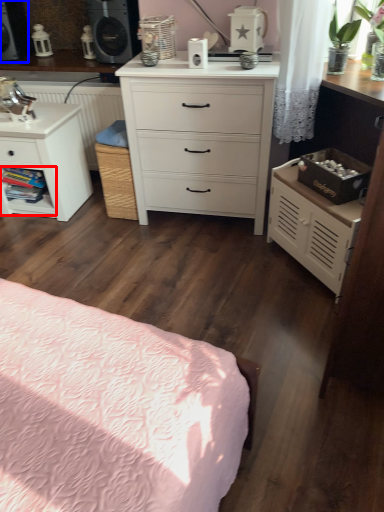
Question: Which of the following is the farthest to the observer, shelf (highlighted by a red box) or speaker (highlighted by a blue box)?

Choices:
 (A) shelf
 (B) speaker

Answer: (A)